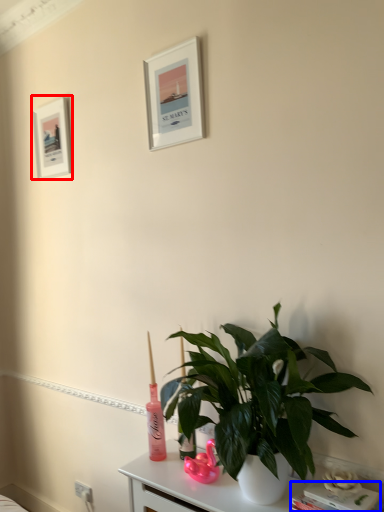
Question: Which of the following is the farthest to the observer, picture frame (highlighted by a red box) or book (highlighted by a blue box)?

Choices:
 (A) picture frame
 (B) book

Answer: (A)